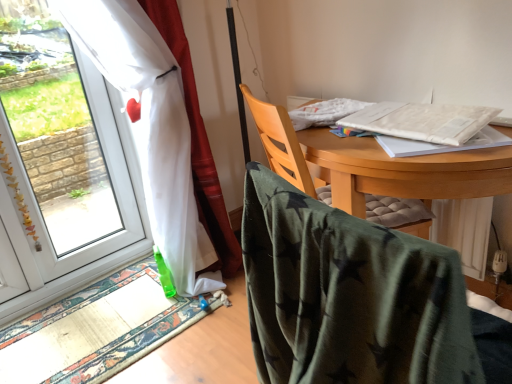
Question: In the image, is white sheer curtain at left positioned in front of or behind transparent glass window at left?

Choices:
 (A) behind
 (B) front

Answer: (B)

Question: From a real-world perspective, is white sheer curtain at left positioned above or below transparent glass window at left?

Choices:
 (A) above
 (B) below

Answer: (B)

Question: Which object is the closest to the green fabric mat at lower left?

Choices:
 (A) transparent glass window at left
 (B) white paper at upper right, which ranks as the second notebook in top-to-bottom order
 (C) white matte notebook at upper right, which appears as the 1th notebook when viewed from the top
 (D) green velvety chair at center, which is the 2th chair from back to front
 (E) wooden chair at center, which is counted as the first chair, starting from the back

Answer: (E)

Question: Based on their relative distances, which object is nearer to the white sheer curtain at left?

Choices:
 (A) wooden chair at center, which appears as the 2th chair when viewed from the front
 (B) transparent glass window at left
 (C) white matte notebook at upper right, which appears as the 1th notebook when viewed from the top
 (D) green fabric mat at lower left
 (E) white paper at upper right, placed as the first notebook when sorted from bottom to top

Answer: (D)